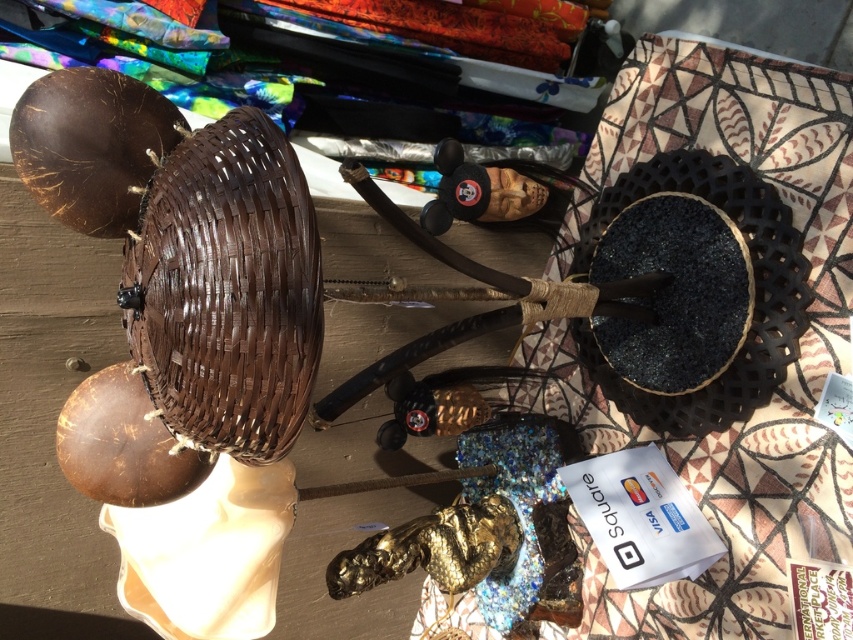
You are standing at the market stall looking at the items displayed on the wooden surface. There are two points marked on the display. Can you tell me which point is closer to you, point A at coordinates point A is point (x=236, y=355) and point B is point (x=619, y=397)? Please answer based on their positions in the scene.

Point A at coordinates point A is point (x=236, y=355) is closer to you than point B at coordinates point B is point (x=619, y=397) because it is positioned in front of point B in the scene.

You are setting up a display at the market and need to place a new item between the brown woven basket at upper left and the coconut shells. According to the coordinates provided, can you determine which object is closer to the center of the wooden surface?

The brown woven basket at upper left is closer to the center of the wooden surface because its coordinates are closer to the center point of the surface compared to the coconut shells.